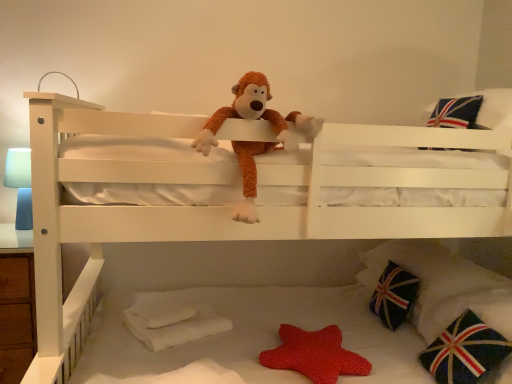
Question: Is red dotted fabric star at lower center, the second toy from the front, far from dark blue fabric pillow with union jack design at lower right, arranged as the 3th pillow when ordered from the bottom?

Choices:
 (A) no
 (B) yes

Answer: (A)

Question: Can you confirm if red dotted fabric star at lower center, the second toy from the front, is positioned to the right of dark blue fabric pillow with union jack design at lower right, arranged as the 3th pillow when ordered from the bottom?

Choices:
 (A) yes
 (B) no

Answer: (B)

Question: Is dark blue fabric pillow with union jack design at lower right, the second pillow when ordered from top to bottom, inside red dotted fabric star at lower center, which appears as the first toy when ordered from the bottom?

Choices:
 (A) yes
 (B) no

Answer: (B)

Question: Is red dotted fabric star at lower center, the 2th toy positioned from the top, located outside dark blue fabric pillow with union jack design at lower right, arranged as the 3th pillow when ordered from the bottom?

Choices:
 (A) yes
 (B) no

Answer: (A)

Question: Is red dotted fabric star at lower center, the 2th toy positioned from the top, smaller than dark blue fabric pillow with union jack design at lower right, arranged as the 3th pillow when ordered from the bottom?

Choices:
 (A) no
 (B) yes

Answer: (B)

Question: Is red dotted fabric star at lower center, which appears as the first toy when ordered from the bottom, shorter than dark blue fabric pillow with union jack design at lower right, arranged as the 3th pillow when ordered from the bottom?

Choices:
 (A) no
 (B) yes

Answer: (B)

Question: Is dark blue fabric pillow with union jack design at lower right, arranged as the 3th pillow when ordered from the bottom, facing towards dark blue fabric pillow with union jack design at lower right, the 4th pillow viewed from the top?

Choices:
 (A) yes
 (B) no

Answer: (B)

Question: Is dark blue fabric pillow with union jack design at lower right, arranged as the 3th pillow when ordered from the bottom, far from dark blue fabric pillow with union jack design at lower right, marked as the 1th pillow in a bottom-to-top arrangement?

Choices:
 (A) no
 (B) yes

Answer: (A)

Question: Is dark blue fabric pillow with union jack design at lower right, arranged as the 3th pillow when ordered from the bottom, in front of dark blue fabric pillow with union jack design at lower right, marked as the 1th pillow in a bottom-to-top arrangement?

Choices:
 (A) no
 (B) yes

Answer: (A)

Question: Is dark blue fabric pillow with union jack design at lower right, arranged as the 3th pillow when ordered from the bottom, positioned with its back to dark blue fabric pillow with union jack design at lower right, the 4th pillow viewed from the top?

Choices:
 (A) no
 (B) yes

Answer: (A)

Question: Is dark blue fabric pillow with union jack design at lower right, arranged as the 3th pillow when ordered from the bottom, positioned behind dark blue fabric pillow with union jack design at lower right, the 4th pillow viewed from the top?

Choices:
 (A) yes
 (B) no

Answer: (A)

Question: Is dark blue fabric pillow with union jack design at lower right, arranged as the 3th pillow when ordered from the bottom, to the left of dark blue fabric pillow with union jack design at lower right, marked as the 1th pillow in a bottom-to-top arrangement, from the viewer's perspective?

Choices:
 (A) yes
 (B) no

Answer: (A)

Question: Can you confirm if blue matte table lamp at left is shorter than union jack fabric pillow at upper right, placed as the 1th pillow when sorted from top to bottom?

Choices:
 (A) yes
 (B) no

Answer: (B)